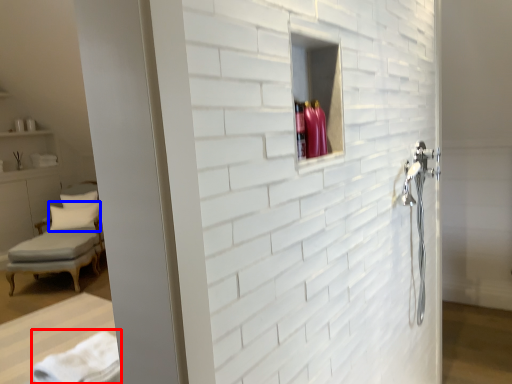
Question: Among these objects, which one is nearest to the camera, bath towel (highlighted by a red box) or pillow (highlighted by a blue box)?

Choices:
 (A) bath towel
 (B) pillow

Answer: (A)